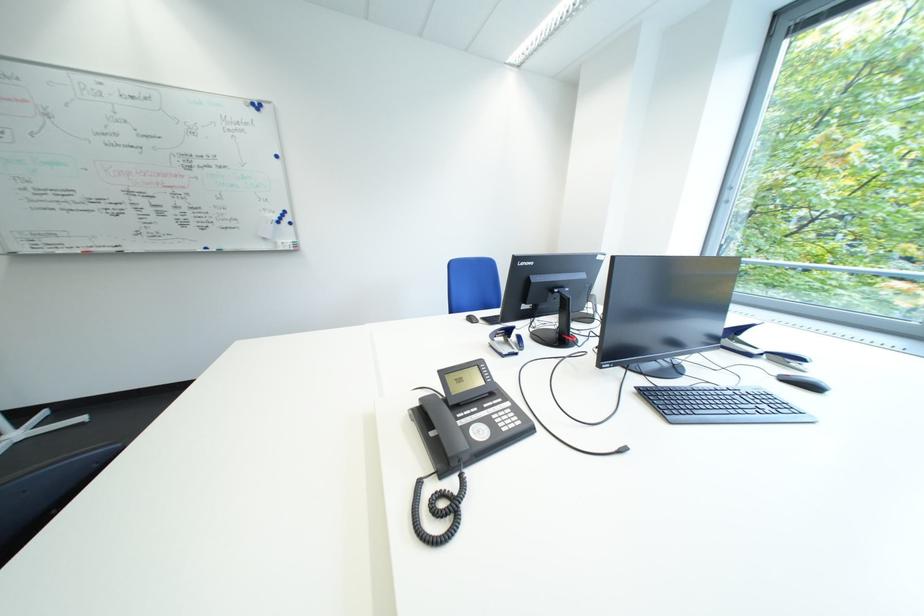
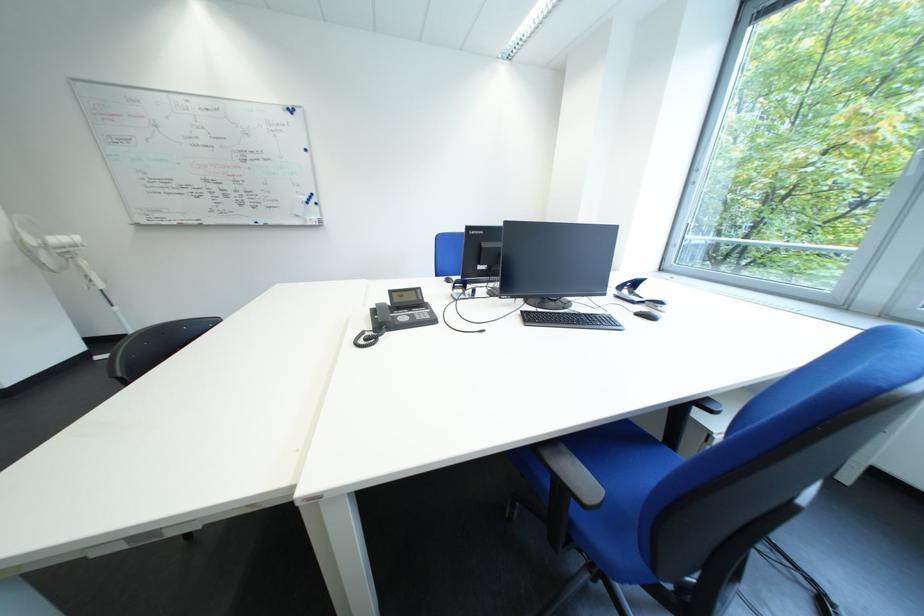
Find the pixel in the second image that matches point (801, 383) in the first image.

(652, 317)